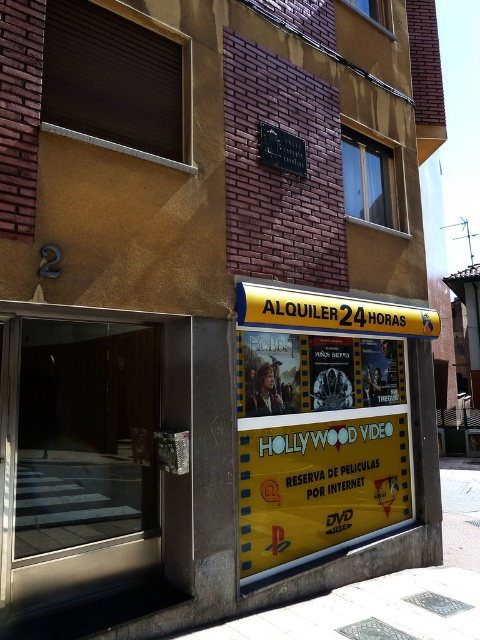
From the picture: You are a customer entering the building and see the transparent glass door at left and the yellow filmstrip at center. Which object is shorter?

The transparent glass door at left is shorter than the yellow filmstrip at center.

You are a delivery person who needs to place a package on the ground near the yellow filmstrip at center. The package must be placed exactly 1 meter away from the white concrete pavement at lower center. Can you place the package at the required distance? Explain your reasoning.

The yellow filmstrip at center is 1.11 meters away from the white concrete pavement at lower center. Since the required distance is 1 meter, placing the package exactly at the yellow filmstrip at center would be 0.11 meters too far. Therefore, you should place the package slightly closer to the white concrete pavement at lower center to meet the 1 meter requirement.

You are a customer looking to enter the store. You notice the yellow filmstrip at center and the white concrete pavement at lower center. Which one is wider?

The yellow filmstrip at center is narrower than the white concrete pavement at lower center. Therefore, the white concrete pavement at lower center is wider.